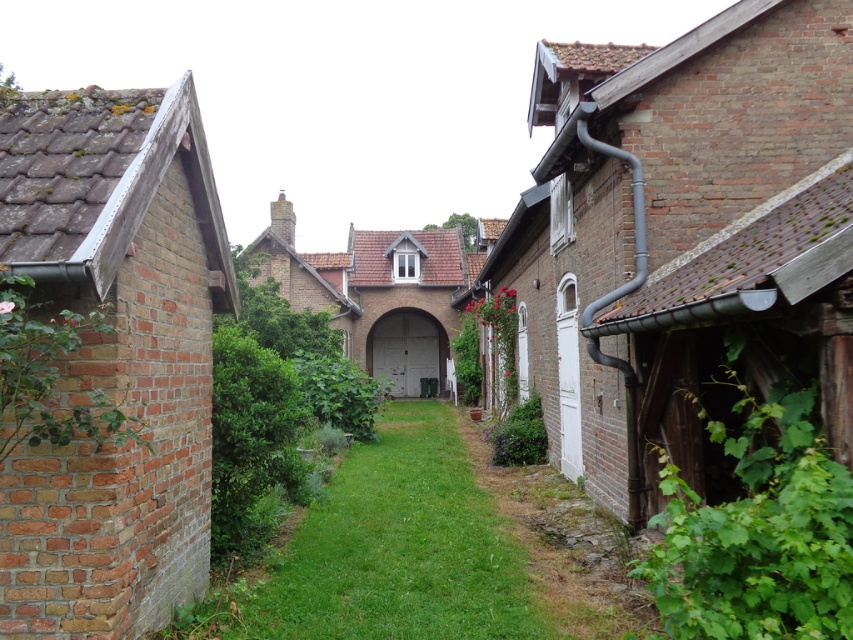
Which of these two, green grass at center or brown stone path at lower right, stands shorter?

With less height is brown stone path at lower right.

Does green grass at center appear under brown stone path at lower right?

No.

Is point (386, 636) positioned after point (573, 509)?

No, (386, 636) is in front of (573, 509).

Locate an element on the screen. Image resolution: width=853 pixels, height=640 pixels. green grass at center is located at coordinates (399, 547).